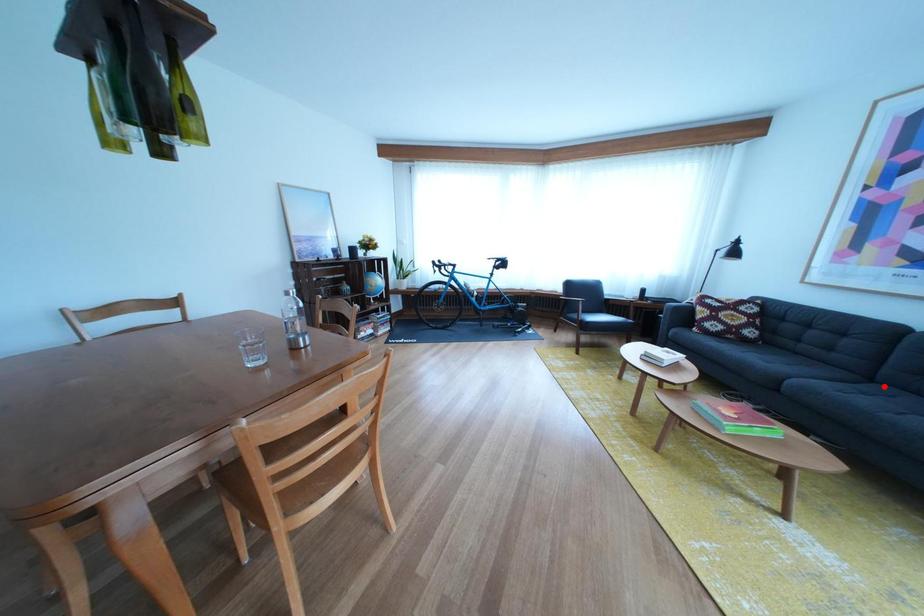
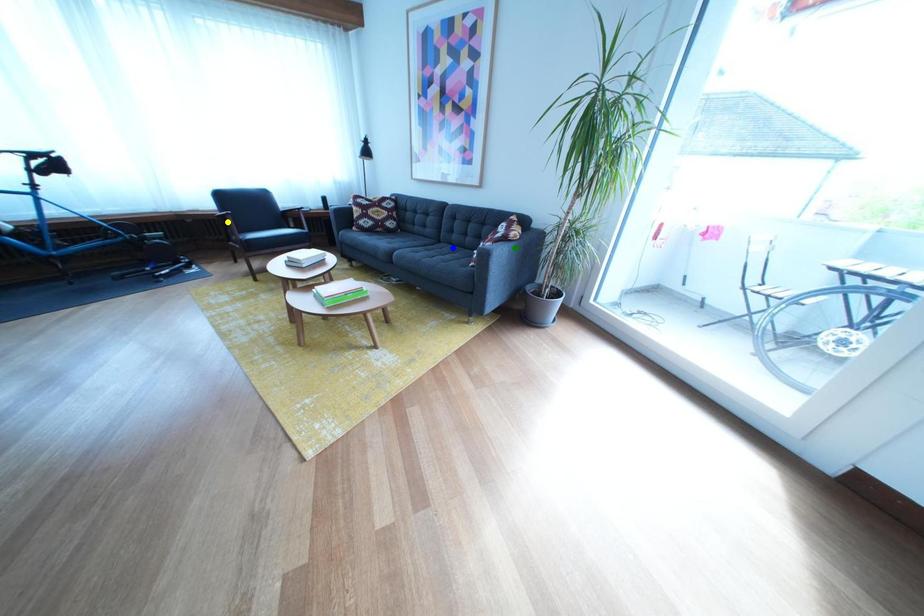
Question: I am providing you with two images of the same scene from different viewpoints. A red point is marked on the first image. You are given multiple points on the second image. Which mark in image 2 goes with the point in image 1?

Choices:
 (A) yellow point
 (B) blue point
 (C) green point

Answer: (B)